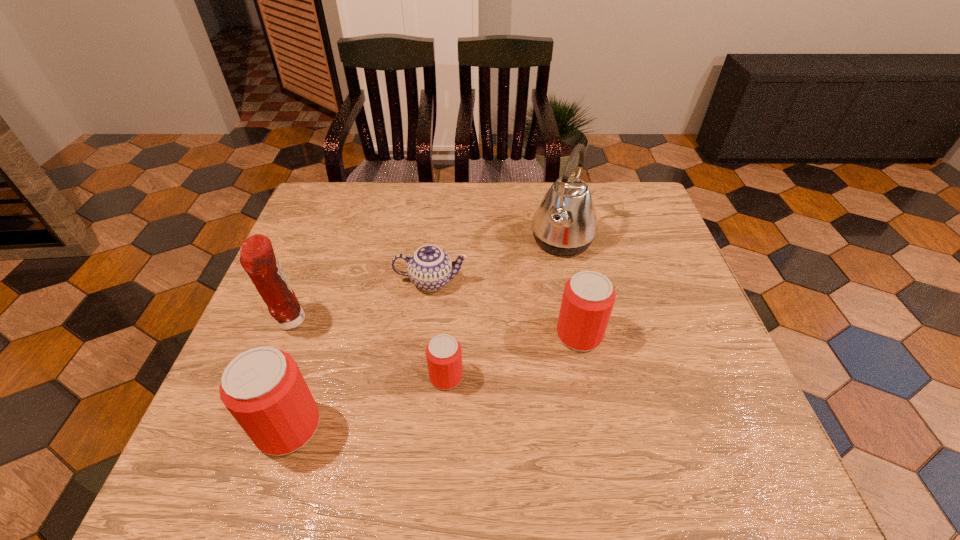
Locate an element on the screen. vacant spot to place a beer can on the right is located at coordinates pyautogui.click(x=693, y=299).